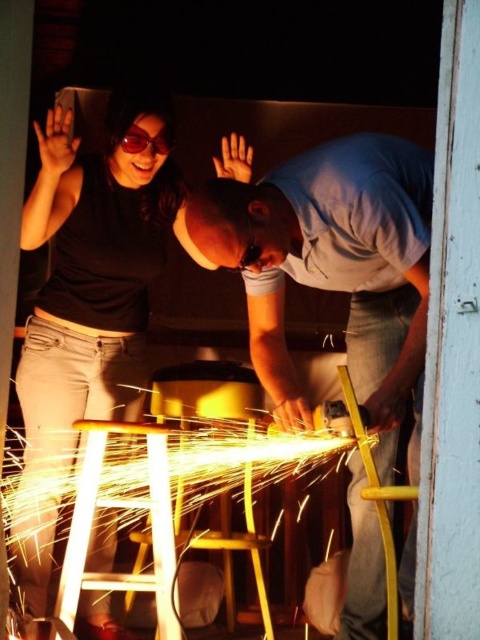
Which is below, matte gray shirt at center or black matte shirt at upper left?

Positioned lower is matte gray shirt at center.

Is matte gray shirt at center thinner than black matte shirt at upper left?

No, matte gray shirt at center is not thinner than black matte shirt at upper left.

Who is more forward, (274, 250) or (163, 193)?

Point (274, 250) is in front.

Find the location of a particular element. This screenshot has width=480, height=640. matte gray shirt at center is located at coordinates (334, 268).